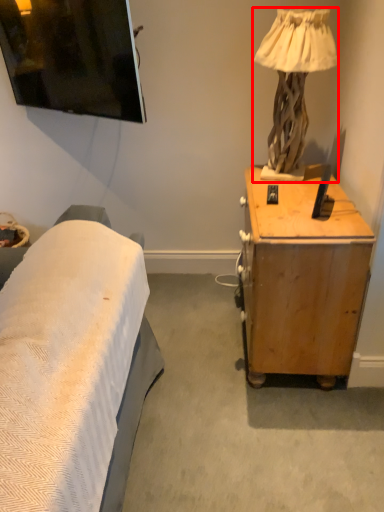
Question: From the image's perspective, where is lamp (annotated by the red box) located relative to desk?

Choices:
 (A) below
 (B) above

Answer: (B)